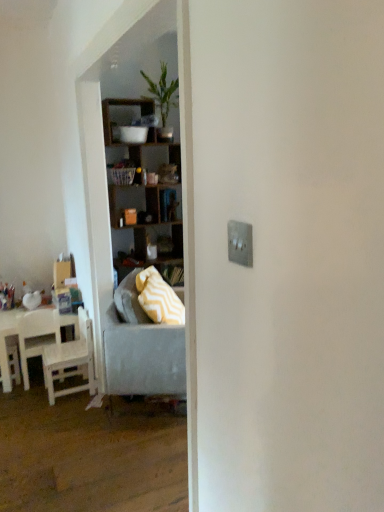
Locate an element on the screen. The image size is (384, 512). vacant region to the left of white wood chair at left, marked as the first chair in a right-to-left arrangement is located at coordinates (17, 397).